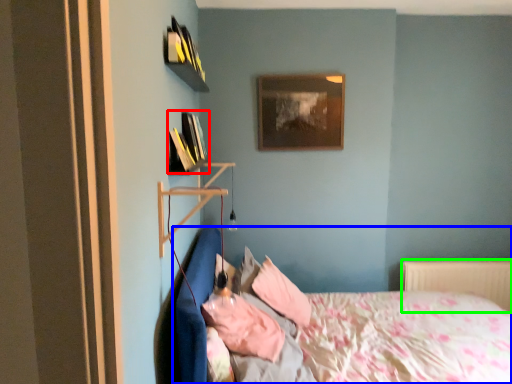
Question: Considering the real-world distances, which object is closest to book (highlighted by a red box)? bed (highlighted by a blue box) or radiator (highlighted by a green box).

Choices:
 (A) bed
 (B) radiator

Answer: (A)